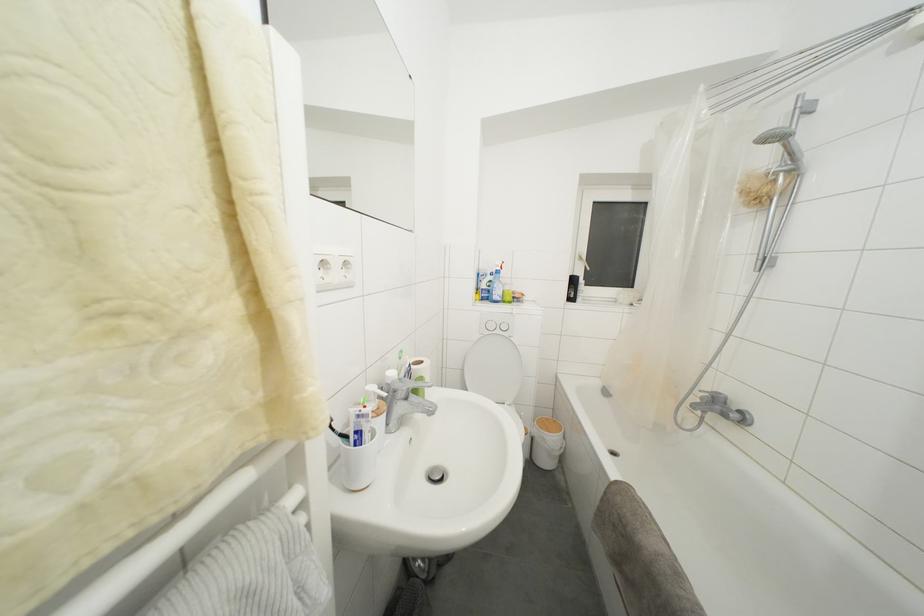
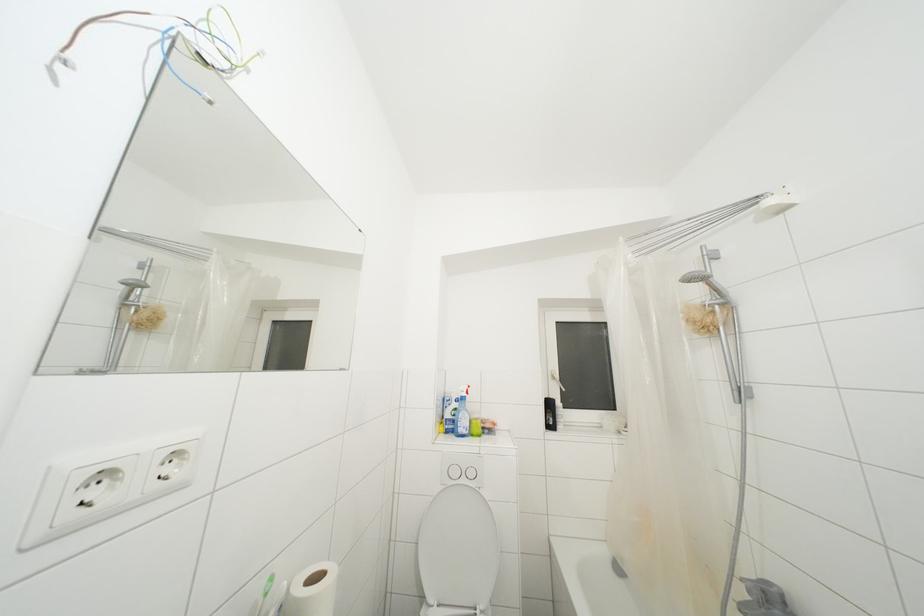
What movement of the cameraman would produce the second image?

The movement direction of the cameraman is right, forward.